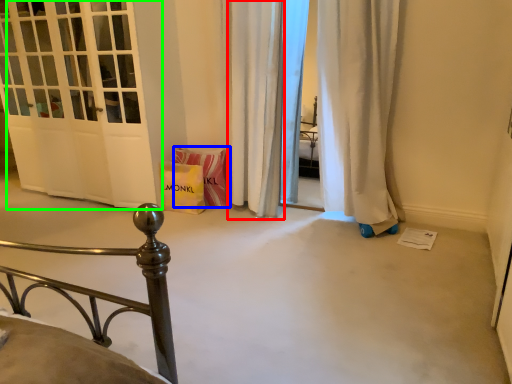
Question: Which object is positioned farthest from curtain (highlighted by a red box)? Select from material (highlighted by a blue box) and door (highlighted by a green box).

Choices:
 (A) material
 (B) door

Answer: (B)